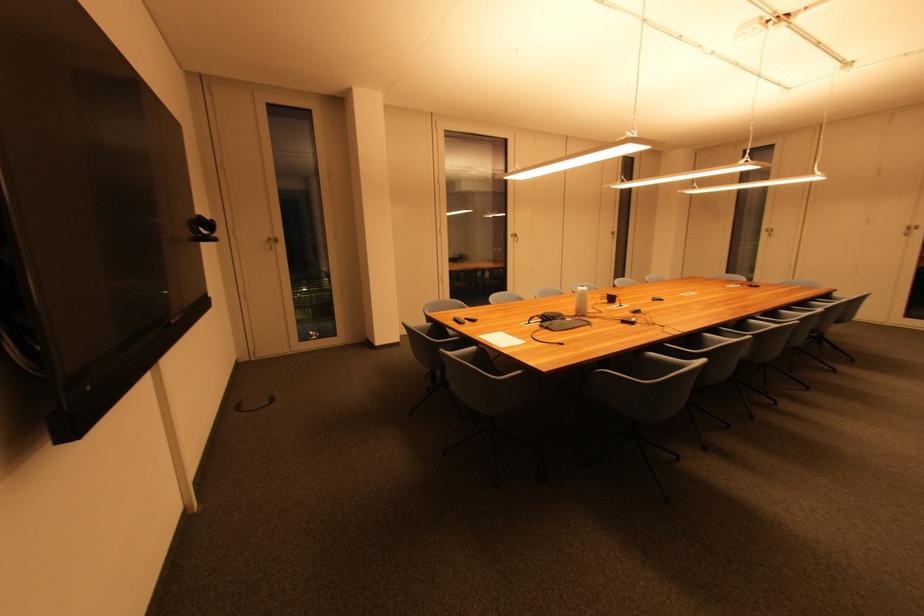
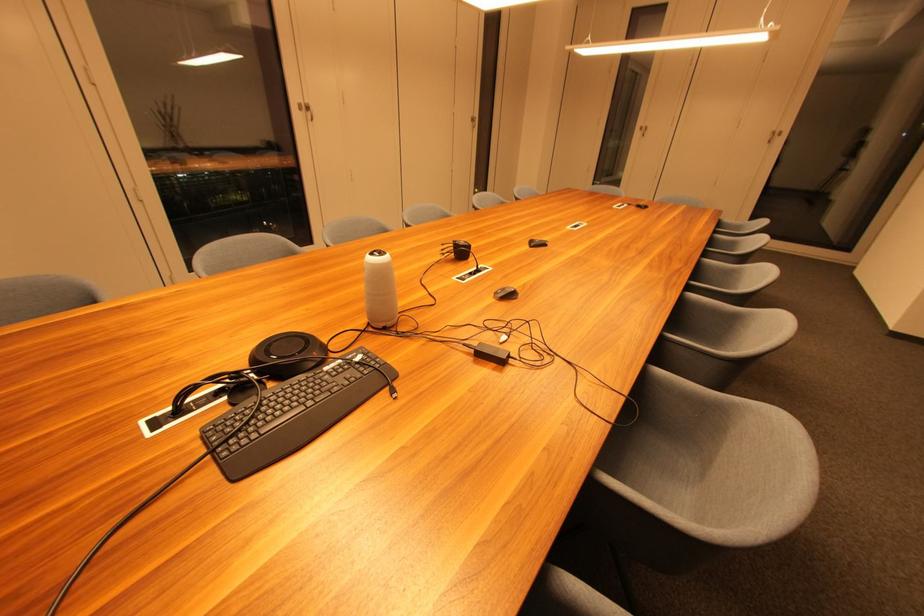
Find the pixel in the second image that matches point (573, 322) in the first image.

(332, 371)